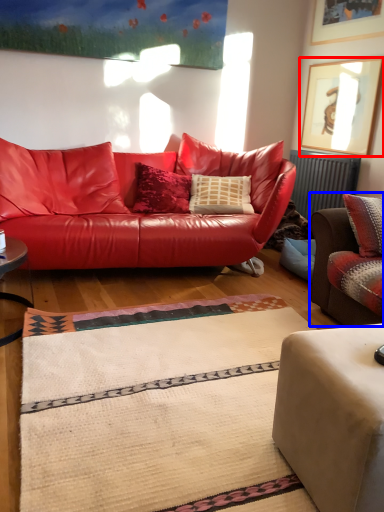
Question: Which object appears farthest to the camera in this image, picture frame (highlighted by a red box) or studio couch (highlighted by a blue box)?

Choices:
 (A) picture frame
 (B) studio couch

Answer: (A)